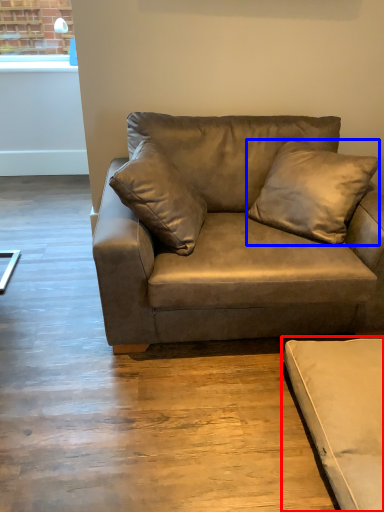
Question: Among these objects, which one is nearest to the camera, studio couch (highlighted by a red box) or pillow (highlighted by a blue box)?

Choices:
 (A) studio couch
 (B) pillow

Answer: (A)